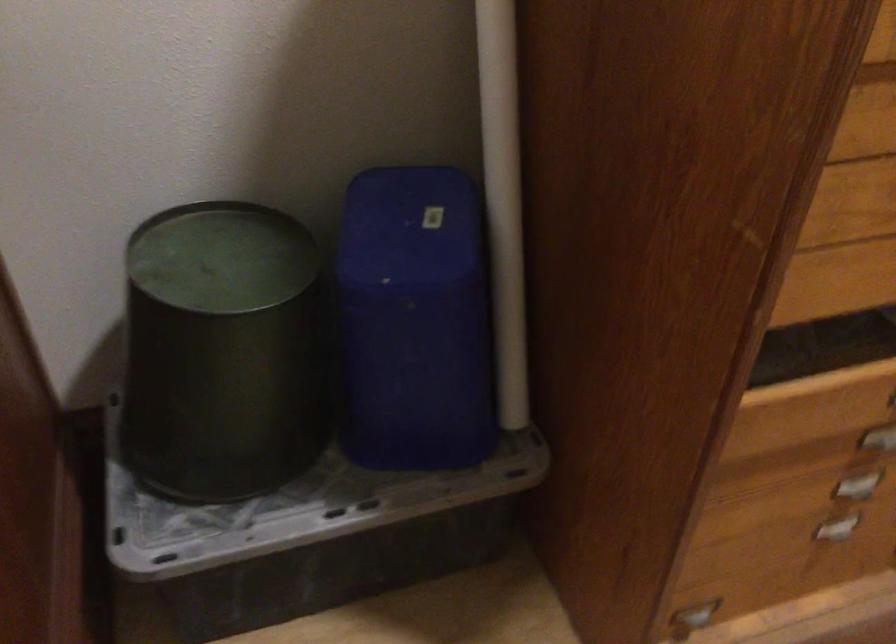
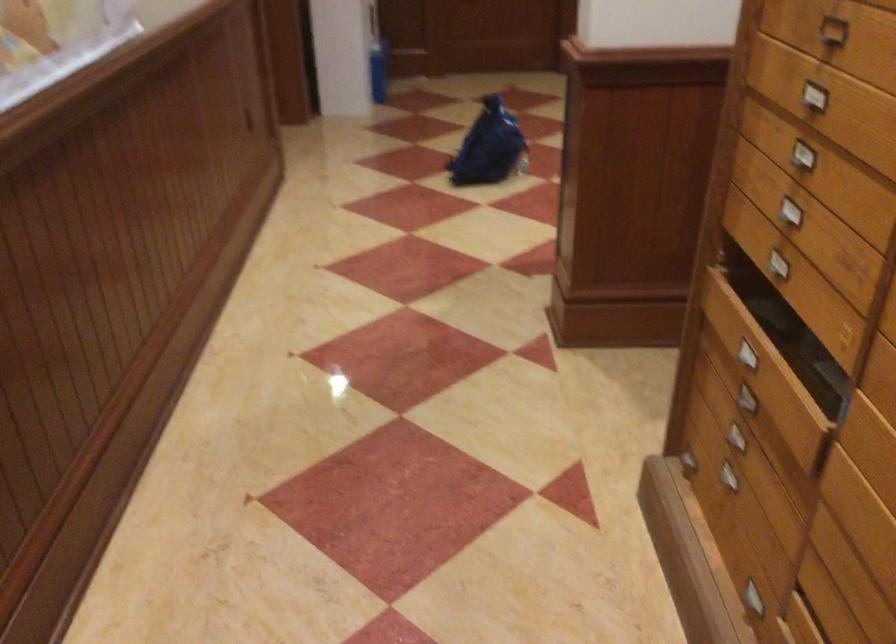
Question: I am providing you with two images of the same scene from different viewpoints. Please identify which objects are invisible in image2.

Choices:
 (A) metal drawer handle
 (B) blue plastic bag
 (C) floral sofa sitting surface
 (D) green round bin

Answer: (D)